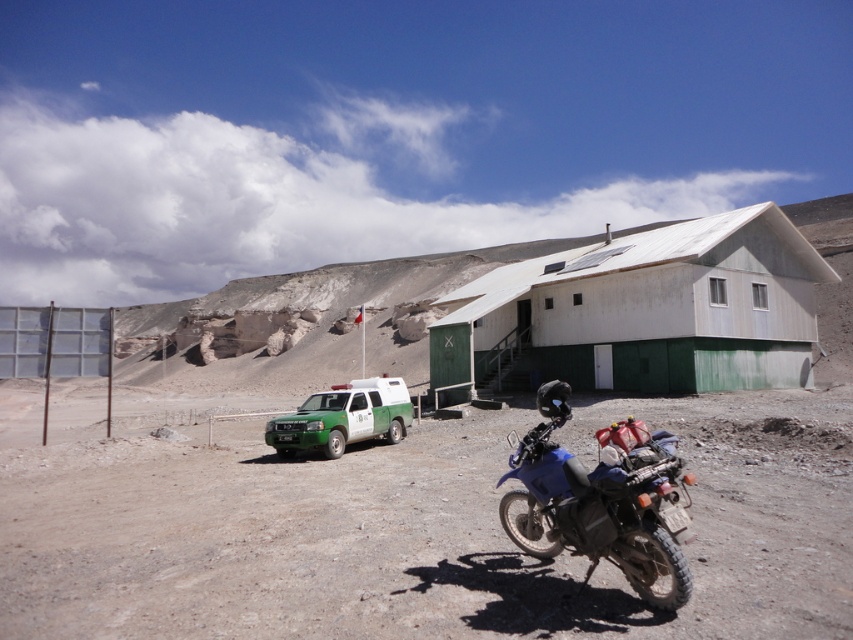
Looking at this image, you are standing at the point closer to the camera between the two points, point (264, 611) and point (637, 531). Which point are you at?

You are at point (264, 611) because it is further to the camera than point (637, 531).

You are standing at the point labeled point (546, 518) and want to walk to the point labeled point (265, 432). Which direction should you move relative to your current position?

You should move downward and to the right because point (265, 432) is located below and to the right of point (546, 518).

You are planning to transport a large piece of equipment that requires a wide space. You have to choose between placing it inside the white matte hut at center or the green matte utility vehicle at lower left. Based on the scene, which location can accommodate the equipment due to its greater width?

The white matte hut at center has a greater width than the green matte utility vehicle at lower left, so it can accommodate the large equipment.